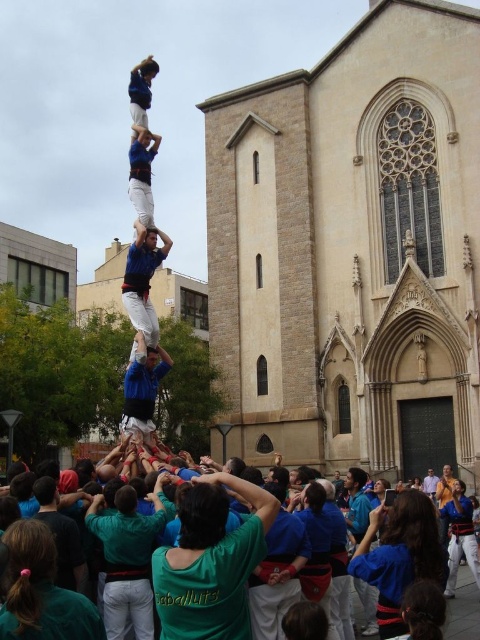
You are a photographer at the event and want to capture the blue fabric man at center and the blue fabric crowd at lower center in a single frame. Based on their sizes, which one would appear larger in your photo?

The blue fabric man at center appears larger in the photo because he is taller than the blue fabric crowd at lower center.

You are a photographer standing in the crowd and want to capture both the point at [158,260] and the point at [430,497] in your photo. Which point is closer to you?

Point at [158,260] is closer to the photographer than point at [430,497].

Based on the scene described, which object is taller between the blue fabric man at center and the light blue shirt at center?

The blue fabric man at center is much taller than the light blue shirt at center.